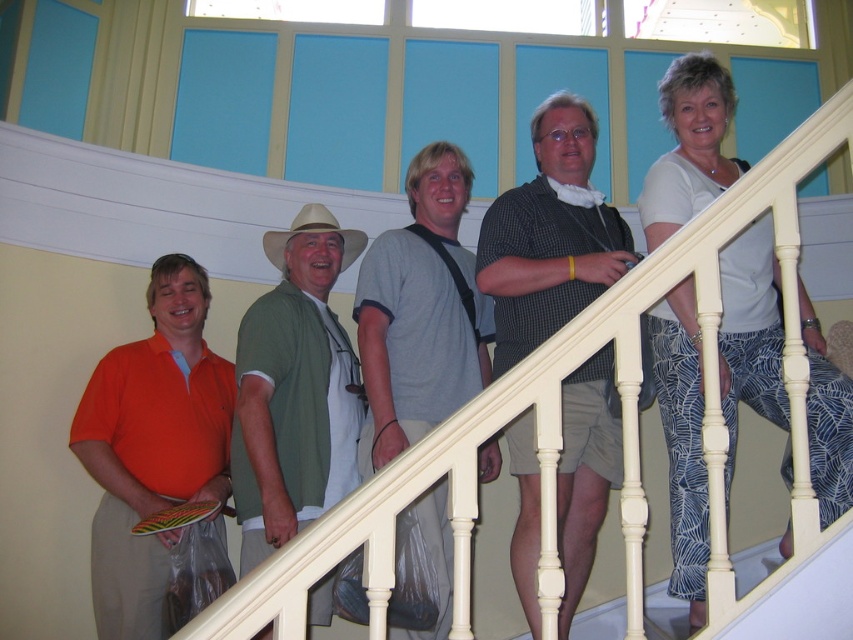
Consider the image. Which is above, green fabric shirt at center or tan straw cowboy hat at center?

Positioned higher is tan straw cowboy hat at center.

Between point (335, 356) and point (277, 252), which one is positioned in front?

Point (335, 356) is more forward.

Locate an element on the screen. Image resolution: width=853 pixels, height=640 pixels. green fabric shirt at center is located at coordinates (294, 388).

Can you confirm if checkered shirt at center is positioned to the right of tan straw cowboy hat at center?

Yes, checkered shirt at center is to the right of tan straw cowboy hat at center.

Is point (598, 193) in front of point (361, 230)?

Yes, point (598, 193) is in front of point (361, 230).

You are a GUI agent. You are given a task and a screenshot of the screen. Output one action in this format:
    pyautogui.click(x=<x>, y=<y>)
    Task: Click on the checkered shirt at center
    The image size is (853, 640).
    Given the screenshot: What is the action you would take?
    pyautogui.click(x=550, y=236)

Where is `checkered shirt at center`? checkered shirt at center is located at coordinates (550, 236).

Which is behind, point (548, 285) or point (395, 340)?

Point (395, 340)

How much distance is there between checkered shirt at center and gray cotton t-shirt at center?

checkered shirt at center is 14.33 feet away from gray cotton t-shirt at center.

Which is behind, point (502, 276) or point (419, 372)?

The point (419, 372) is behind.

Where is `checkered shirt at center`? This screenshot has width=853, height=640. checkered shirt at center is located at coordinates (550, 236).